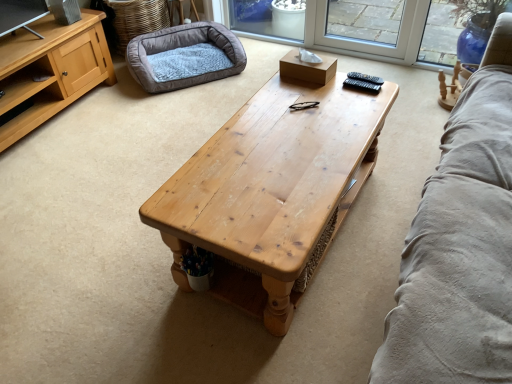
Question: From the image's perspective, relative to wooden coffee table at center, is soft gray plush dog bed at upper left above or below?

Choices:
 (A) above
 (B) below

Answer: (A)

Question: Relative to wooden coffee table at center, is soft gray plush dog bed at upper left in front or behind?

Choices:
 (A) behind
 (B) front

Answer: (A)

Question: From a real-world perspective, is soft gray plush dog bed at upper left above or below wooden coffee table at center?

Choices:
 (A) above
 (B) below

Answer: (B)

Question: Does point (331, 170) appear closer or farther from the camera than point (130, 51)?

Choices:
 (A) closer
 (B) farther

Answer: (A)

Question: In terms of width, does wooden coffee table at center look wider or thinner when compared to soft gray plush dog bed at upper left?

Choices:
 (A) wide
 (B) thin

Answer: (A)

Question: From the image's perspective, is wooden coffee table at center above or below soft gray plush dog bed at upper left?

Choices:
 (A) below
 (B) above

Answer: (A)

Question: Considering the positions of wooden coffee table at center and soft gray plush dog bed at upper left in the image, is wooden coffee table at center bigger or smaller than soft gray plush dog bed at upper left?

Choices:
 (A) small
 (B) big

Answer: (B)